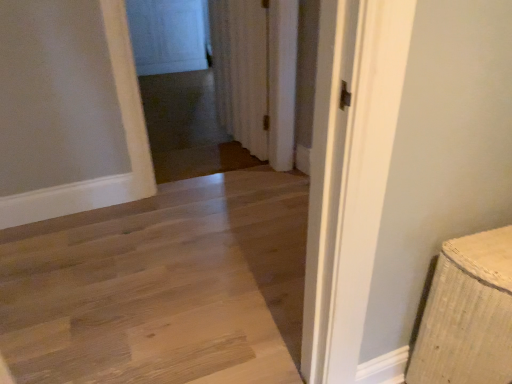
In order to click on vacant point above natural wood floor at center (from a real-world perspective) in this screenshot , I will do `click(178, 273)`.